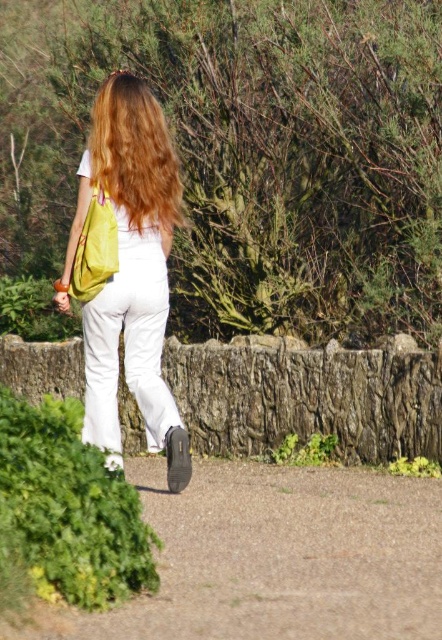
You are a photographer trying to capture the person walking along the path. You want to ensure that both the matte yellow backpack at center and the shiny brown hair at upper center are clearly visible in the photo. Based on their positions, which object should you focus on first to ensure both are in focus?

The matte yellow backpack at center is in front of the shiny brown hair at upper center, so you should focus on the matte yellow backpack at center first to ensure both are in focus.

You are a landscape architect designing a path. The gravel at center and yellow fabric bag at back are in the scene. Which object is wider?

The gravel at center is wider than the yellow fabric bag at back.

You are a photographer trying to capture the person walking along the gravel path. You want to ensure the matte yellow backpack at center and the shiny brown hair at upper center are both visible in the frame. Based on their positions, which object should appear to the left in your photo?

The matte yellow backpack at center is positioned on the left side of shiny brown hair at upper center, so in the photo, the matte yellow backpack at center will appear to the left of the shiny brown hair at upper center.